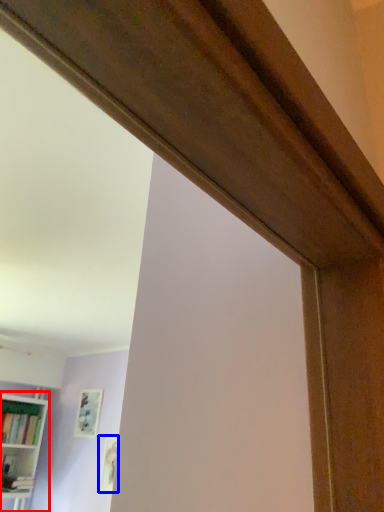
Question: Which object is closer to the camera taking this photo, bookcase (highlighted by a red box) or picture frame (highlighted by a blue box)?

Choices:
 (A) bookcase
 (B) picture frame

Answer: (A)